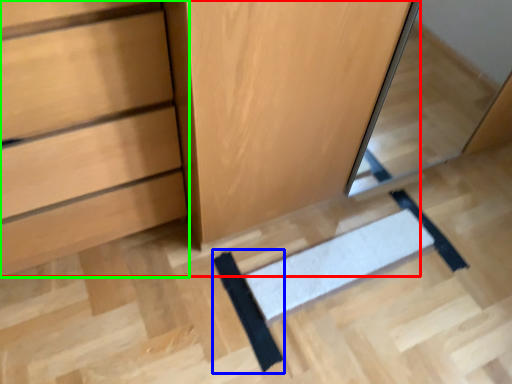
Question: Which object is positioned closest to dresser (highlighted by a red box)? Select from doormat (highlighted by a blue box) and chest of drawers (highlighted by a green box).

Choices:
 (A) doormat
 (B) chest of drawers

Answer: (B)